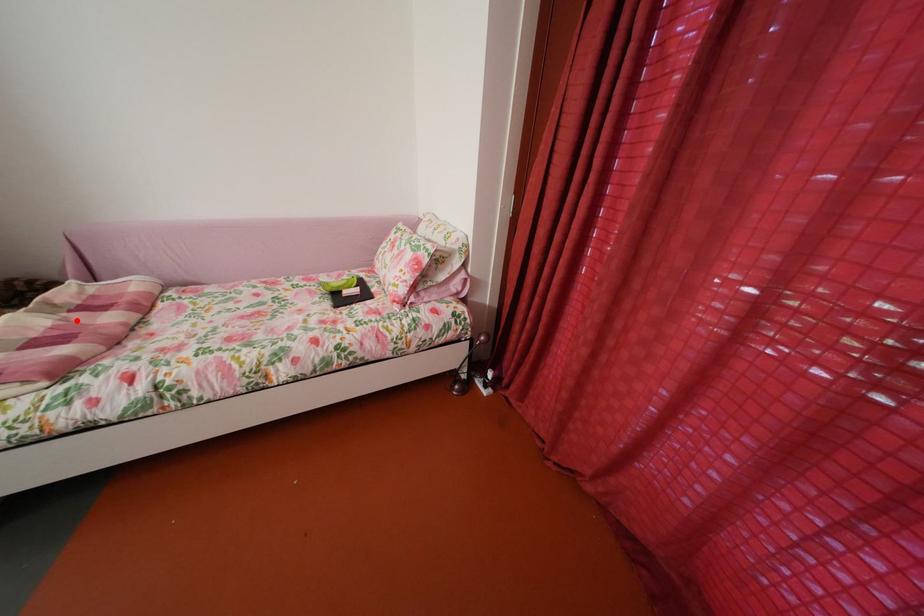
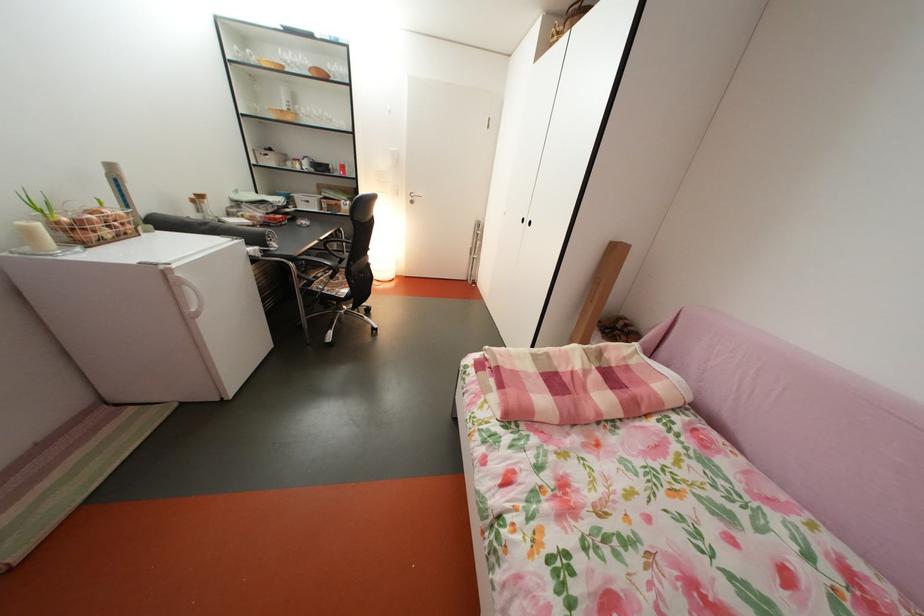
Question: I am providing you with two images of the same scene from different viewpoints. Image1 has a red point marked. In image2, the corresponding 3D location appears at what relative position? Reply with the corresponding letter.

Choices:
 (A) Closer
 (B) Farther

Answer: (B)